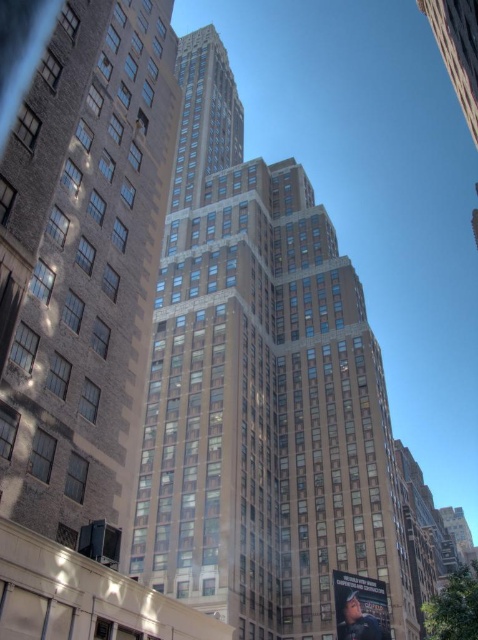
Consider the image. You are an architect analyzing the layout of a city block. You observe the brown stone building at center and the brown brick building at left. Based on their positions, which building would cast a longer shadow during midday in summer?

The brown stone building at center is positioned over the brown brick building at left, meaning it is taller. Therefore, the brown stone building at center would cast a longer shadow during midday in summer.

In the scene shown: You are standing in an urban area and see the brown stone building at center. Based on its 2D coordinates, can you determine if it is positioned to the left or right side of the image?

The brown stone building at center is located at coordinates point [260,392], which places it closer to the right side of the image compared to the center point.

From the picture: You are standing in front of two buildings in an urban area. You see the brown stone building at center and the brown brick building at left. Which building is located to the left?

The brown brick building at left is located to the left of the brown stone building at center.